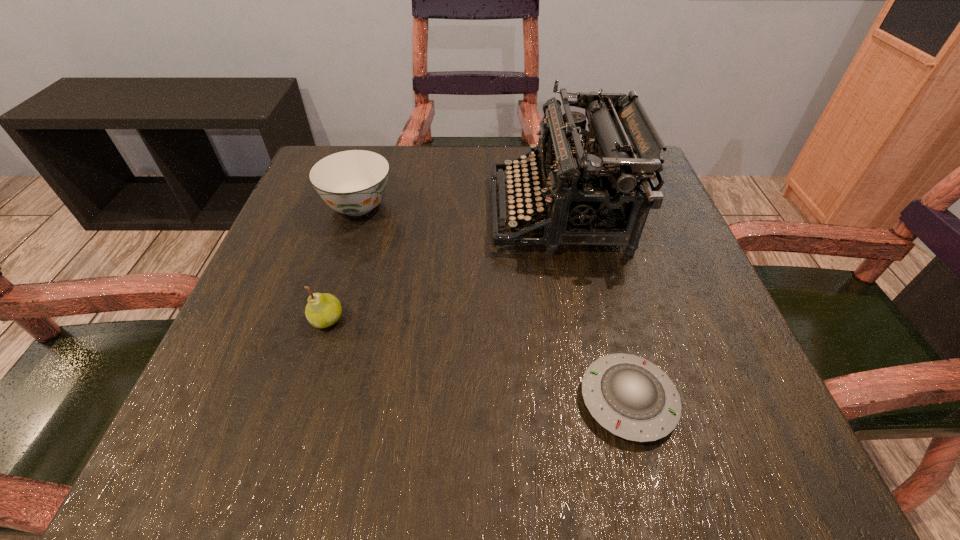
Where is `vacant region that satisfies the following two spatial constraints: 1. on the typing side of the tallest object; 2. on the back side of the shortest object`? vacant region that satisfies the following two spatial constraints: 1. on the typing side of the tallest object; 2. on the back side of the shortest object is located at coordinates (596, 400).

Locate an element on the screen. vacant region that satisfies the following two spatial constraints: 1. on the typing side of the tallest object; 2. on the front side of the third farthest object is located at coordinates (580, 320).

The height and width of the screenshot is (540, 960). I want to click on free space in the image that satisfies the following two spatial constraints: 1. on the front side of the soup bowl; 2. on the left side of the saucer, so click(297, 400).